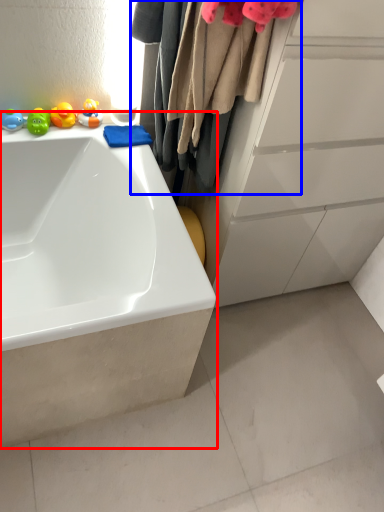
Question: Which point is closer to the camera, bathtub (highlighted by a red box) or laundry (highlighted by a blue box)?

Choices:
 (A) bathtub
 (B) laundry

Answer: (B)